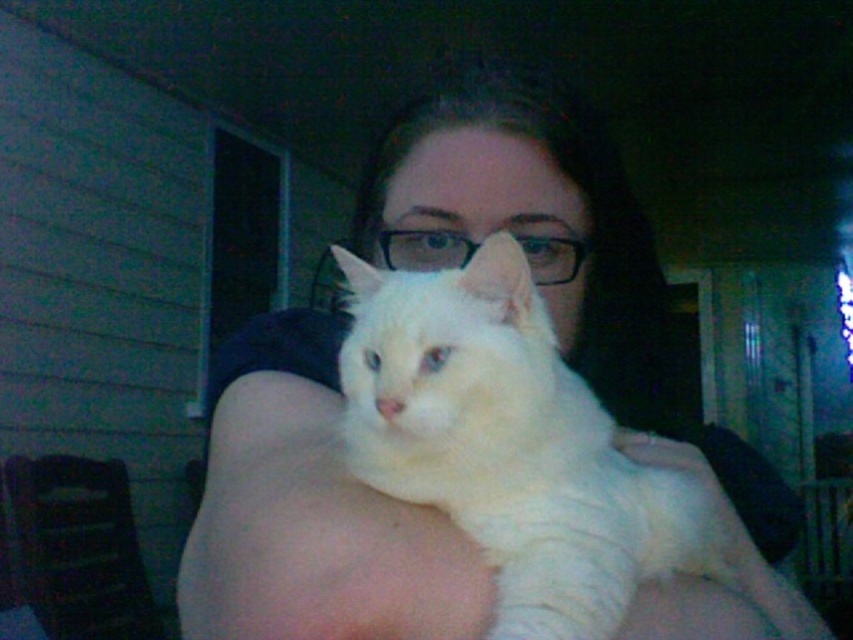
You are a photographer trying to capture the white fur cat at center and the white fluffy cat at center in a single frame. Based on their positions, which cat should you focus on first to ensure both are in the shot?

The white fluffy cat at center is above the white fur cat at center, so focusing on the higher positioned white fluffy cat at center first will help ensure both are within the frame.

You are a photographer trying to capture the perfect shot of the cats. Since you want to highlight both cats equally, which side should you focus on to ensure both the white fur cat at center and the white fluffy cat at center are visible?

The white fur cat at center is positioned on the right side of the white fluffy cat at center, so focusing on the center area between them would allow both to be visible.

Consider the image. You are a photographer trying to capture the white fluffy cat at center and the white fur at upper center in a clear photo. Since both are white, you want to ensure the cat stands out. According to the scene description, which object is closer to the camera, making it possible to focus on the cat while slightly blurring the background?

The white fluffy cat at center is in front of the white fur at upper center, so focusing on the cat would blur the background fur due to its closer proximity to the camera.